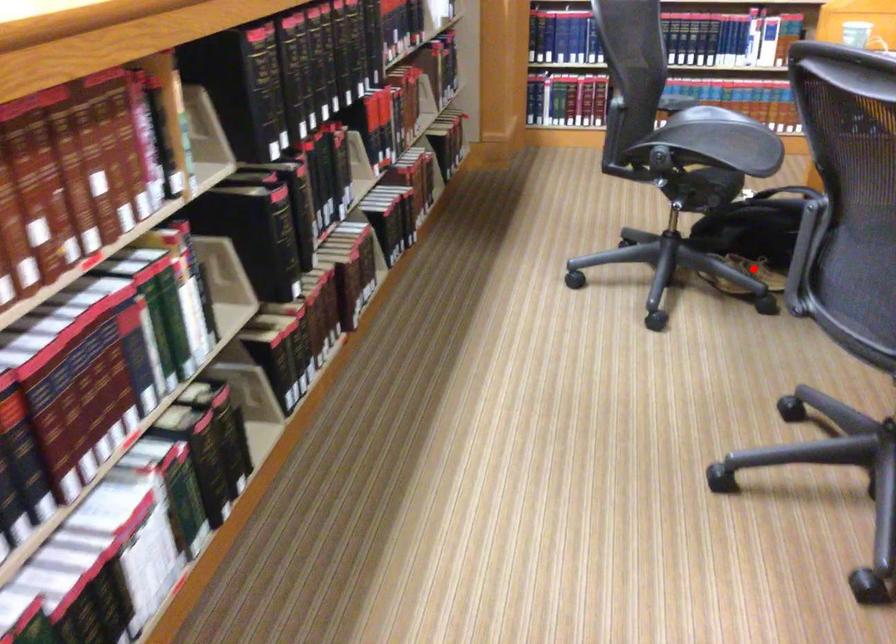
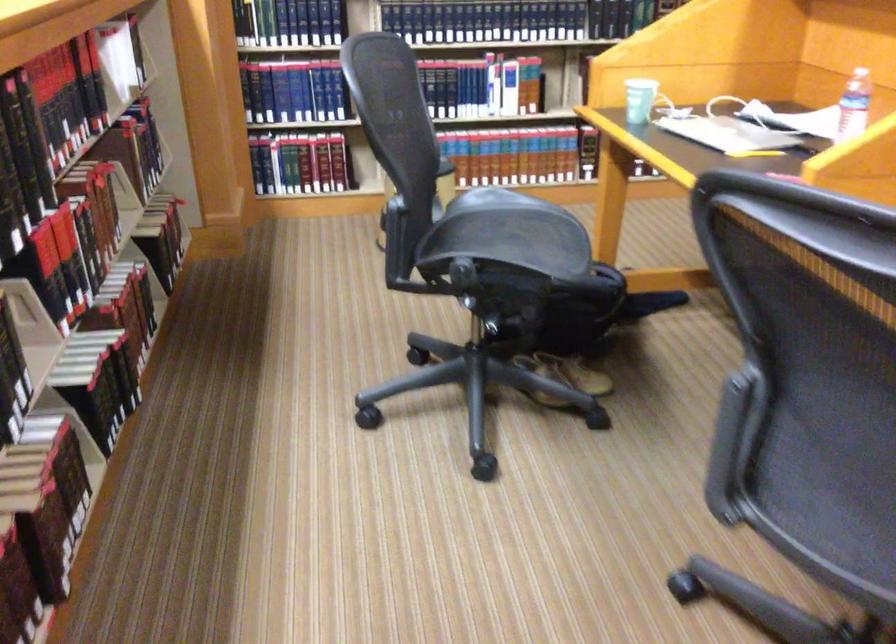
In the second image, find the point that corresponds to the highlighted location in the first image.

(564, 377)